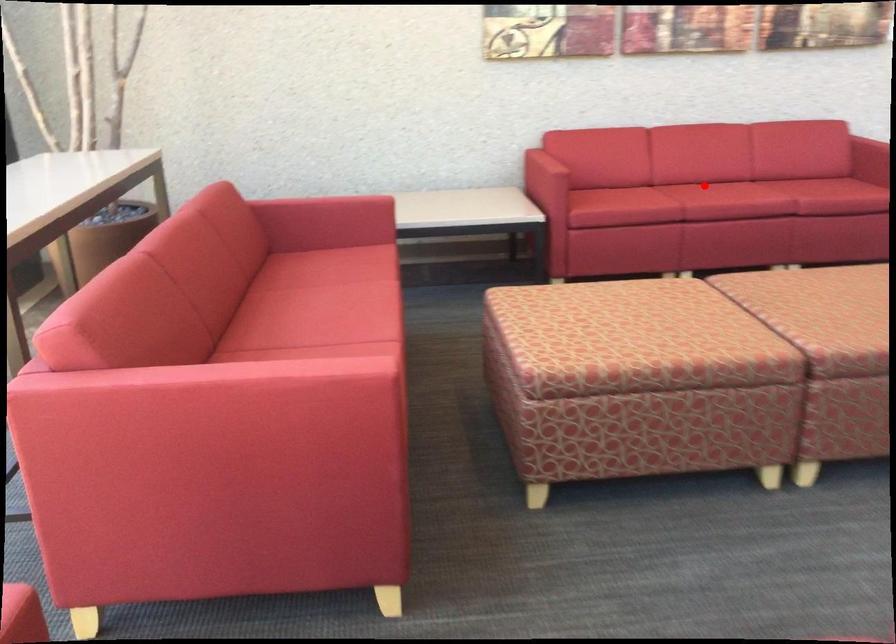
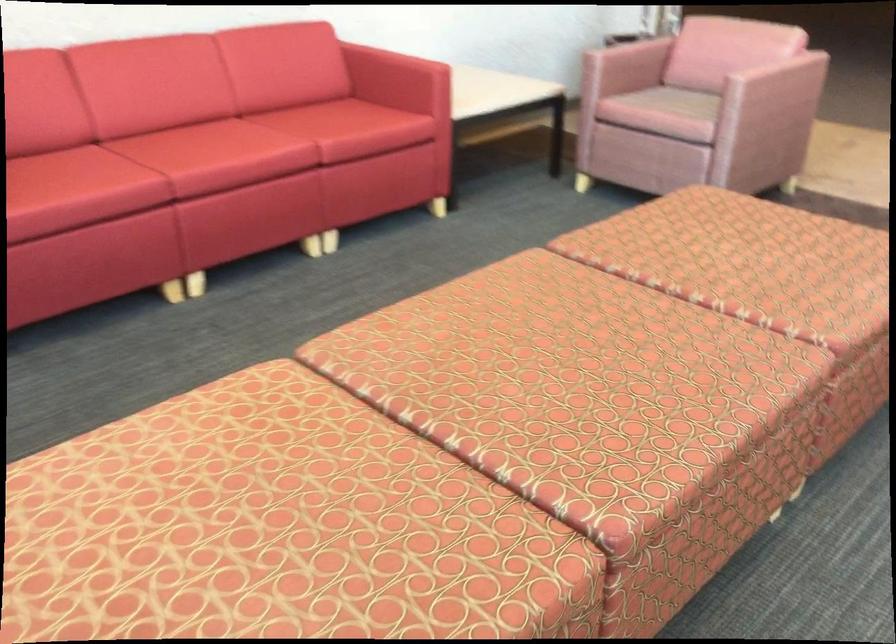
Where in the second image is the point corresponding to the highlighted location from the first image?

(196, 144)